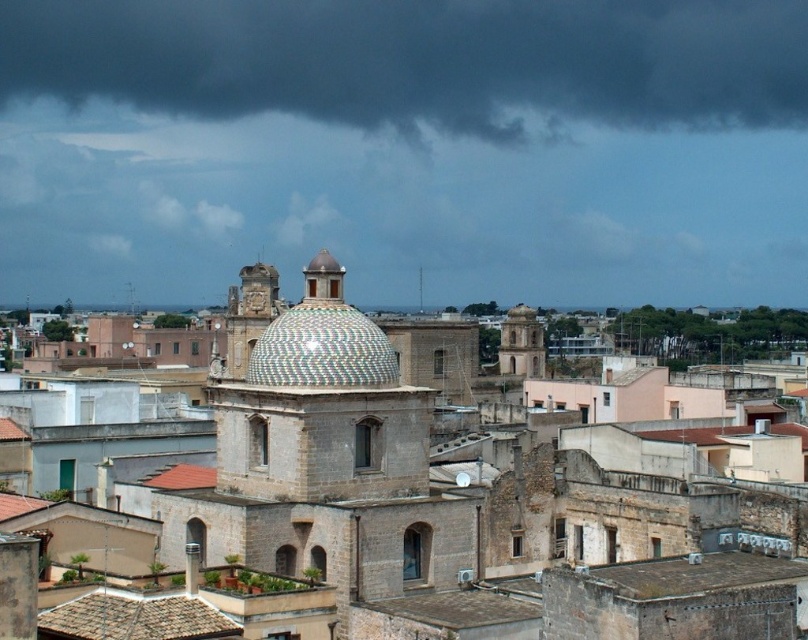
Question: Which point is farther from the camera taking this photo?

Choices:
 (A) (81, 611)
 (B) (266, 358)
 (C) (525, 339)

Answer: (C)

Question: Can you confirm if dark gray cloud at upper center is wider than smooth stone tower at center?

Choices:
 (A) yes
 (B) no

Answer: (A)

Question: Which of the following is the closest to the observer?

Choices:
 (A) (693, 29)
 (B) (541, 364)
 (C) (87, 637)

Answer: (C)

Question: Does dark gray cloud at upper center come in front of smooth stone tower at center?

Choices:
 (A) no
 (B) yes

Answer: (A)

Question: Estimate the real-world distances between objects in this image. Which object is farther from the smooth stone tower at center?

Choices:
 (A) dark gray cloud at upper center
 (B) mosaic tile dome at center

Answer: (A)

Question: Is dark gray cloud at upper center closer to camera compared to smooth stone tower at center?

Choices:
 (A) yes
 (B) no

Answer: (B)